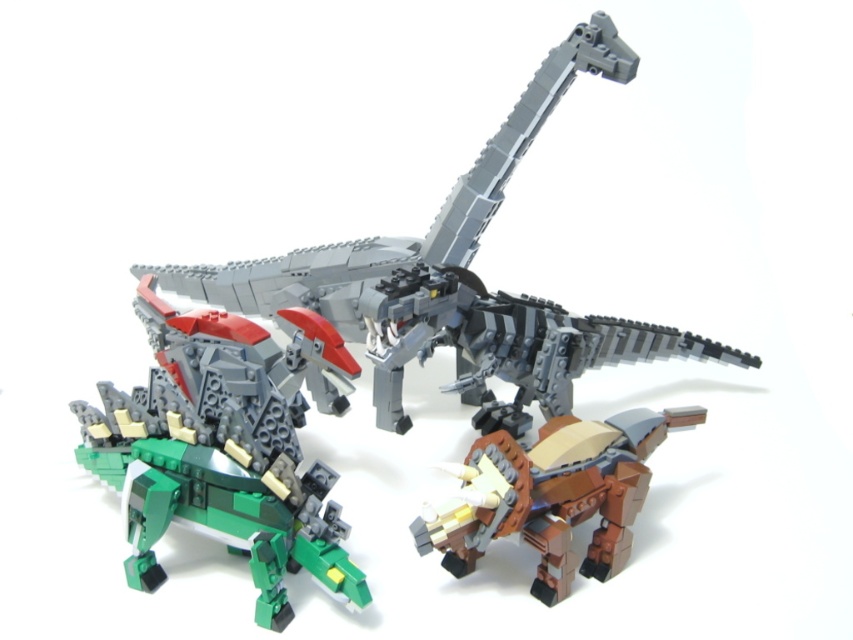
Question: Is green matte/brick-like dinosaur at lower left positioned in front of brown matte/brick-like triceratops at lower right?

Choices:
 (A) no
 (B) yes

Answer: (B)

Question: Is green matte/brick-like dinosaur at lower left smaller than brown matte/brick-like triceratops at lower right?

Choices:
 (A) no
 (B) yes

Answer: (A)

Question: Can you confirm if green matte/brick-like dinosaur at lower left is wider than brown matte/brick-like triceratops at lower right?

Choices:
 (A) yes
 (B) no

Answer: (A)

Question: Among these points, which one is nearest to the camera?

Choices:
 (A) pyautogui.click(x=437, y=534)
 (B) pyautogui.click(x=181, y=490)

Answer: (A)